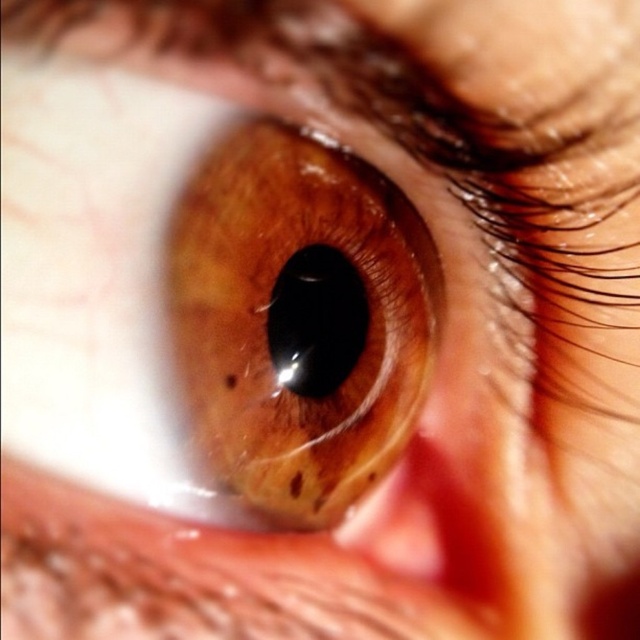
You are a photographer trying to capture the details of the brown glossy eye at center and the black glossy iris at center. Which one appears taller in the photo?

The brown glossy eye at center has a greater height compared to the black glossy iris at center, so the brown glossy eye at center appears taller in the photo.

You are an optometrist examining a patient. You notice the brown glossy eye at center and the black glossy iris at center. Which of these is located above the other?

The brown glossy eye at center is positioned over the black glossy iris at center.

You are an optometrist examining a patient. You notice the brown glossy eye at center and the black glossy iris at center. Which object is positioned more to the left?

The black glossy iris at center is positioned more to the left because the brown glossy eye at center is to the right of it.